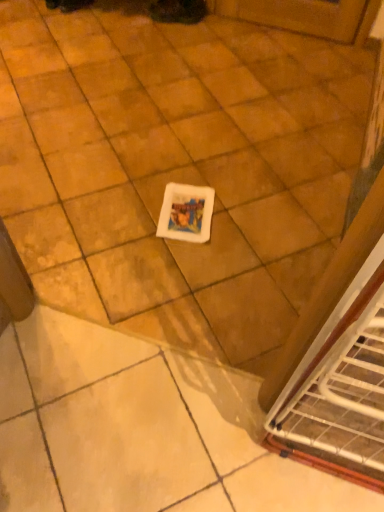
Question: From the image's perspective, would you say matte black shoe at upper center is positioned over white matte tile at center?

Choices:
 (A) no
 (B) yes

Answer: (B)

Question: From a real-world perspective, is matte black shoe at upper center on white matte tile at center?

Choices:
 (A) yes
 (B) no

Answer: (A)

Question: Does matte black shoe at upper center have a larger size compared to white matte tile at center?

Choices:
 (A) yes
 (B) no

Answer: (B)

Question: Can you confirm if matte black shoe at upper center is positioned to the right of white matte tile at center?

Choices:
 (A) no
 (B) yes

Answer: (B)

Question: Can you confirm if matte black shoe at upper center is taller than white matte tile at center?

Choices:
 (A) no
 (B) yes

Answer: (B)

Question: Does matte black shoe at upper center have a greater width compared to white matte tile at center?

Choices:
 (A) yes
 (B) no

Answer: (B)

Question: Is white matte tile at center at the left side of matte black shoe at upper center?

Choices:
 (A) yes
 (B) no

Answer: (A)

Question: Is the depth of white matte tile at center less than that of matte black shoe at upper center?

Choices:
 (A) no
 (B) yes

Answer: (B)

Question: Considering the relative sizes of white matte tile at center and matte black shoe at upper center in the image provided, is white matte tile at center shorter than matte black shoe at upper center?

Choices:
 (A) no
 (B) yes

Answer: (B)

Question: Is white matte tile at center directly adjacent to matte black shoe at upper center?

Choices:
 (A) no
 (B) yes

Answer: (A)

Question: Is white matte tile at center far from matte black shoe at upper center?

Choices:
 (A) yes
 (B) no

Answer: (A)

Question: Is white matte tile at center taller than matte black shoe at upper center?

Choices:
 (A) no
 (B) yes

Answer: (A)

Question: Does point (198, 16) appear closer or farther from the camera than point (269, 242)?

Choices:
 (A) closer
 (B) farther

Answer: (B)